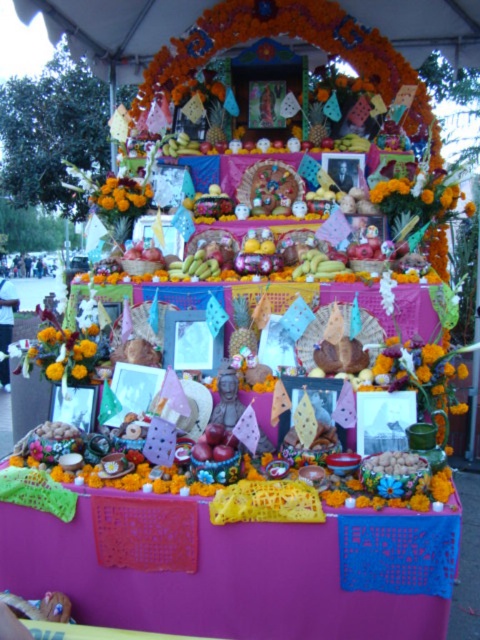
Question: Can you confirm if orange fabric at lower left is bigger than orange matte flower at center?

Choices:
 (A) yes
 (B) no

Answer: (B)

Question: Among these points, which one is nearest to the camera?

Choices:
 (A) (69, 360)
 (B) (14, 310)

Answer: (A)

Question: Which point is closer to the camera taking this photo?

Choices:
 (A) pyautogui.click(x=58, y=358)
 (B) pyautogui.click(x=402, y=182)
 (C) pyautogui.click(x=148, y=202)
 (D) pyautogui.click(x=2, y=326)

Answer: (A)

Question: Does orange marigold at upper right have a greater width compared to matte white woman at lower left?

Choices:
 (A) yes
 (B) no

Answer: (A)

Question: Which object is closer to the camera taking this photo?

Choices:
 (A) orange matte flower at center
 (B) purple fabric table at center

Answer: (B)

Question: Is orange marigold at upper right positioned in front of orange fabric at lower left?

Choices:
 (A) no
 (B) yes

Answer: (A)